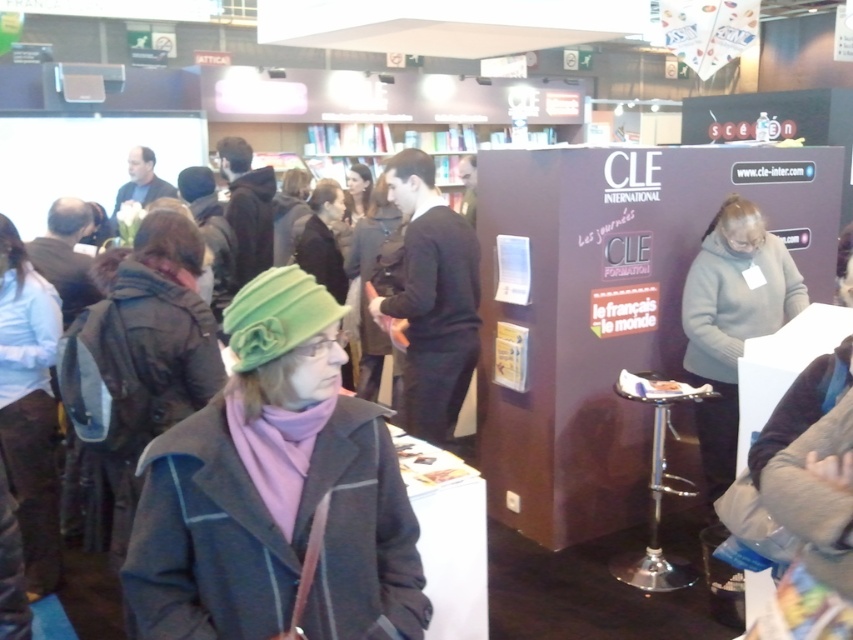
Does green woolen hat at center have a lesser height compared to matte black jacket at center?

In fact, green woolen hat at center may be taller than matte black jacket at center.

Is green woolen hat at center above matte black jacket at center?

Incorrect, green woolen hat at center is not positioned above matte black jacket at center.

I want to click on green woolen hat at center, so click(x=368, y=280).

Who is taller, gray fuzzy sweater at right or green woolen hat at center?

With more height is gray fuzzy sweater at right.

What do you see at coordinates (732, 321) in the screenshot?
I see `gray fuzzy sweater at right` at bounding box center [732, 321].

Find the location of a particular element. The image size is (853, 640). gray fuzzy sweater at right is located at coordinates tap(732, 321).

Who is lower down, gray fuzzy sweater at right or matte black jacket at center?

Positioned lower is gray fuzzy sweater at right.

Is the position of gray fuzzy sweater at right more distant than that of matte black jacket at center?

No, gray fuzzy sweater at right is in front of matte black jacket at center.

Which is behind, point (737, 260) or point (303, 211)?

The point (303, 211) is more distant.

Where is `gray fuzzy sweater at right`? gray fuzzy sweater at right is located at coordinates (732, 321).